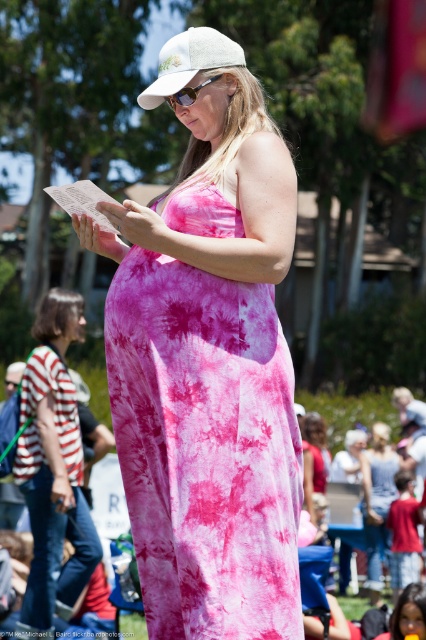
Question: Which object is positioned farthest from the white fabric baseball cap at upper center?

Choices:
 (A) tie-dye fabric dress at center
 (B) tie-dye fabric maxi dress at center

Answer: (B)

Question: Which of these objects is positioned closest to the white fabric baseball cap at upper center?

Choices:
 (A) tie-dye fabric dress at center
 (B) tie-dye fabric maxi dress at center

Answer: (A)

Question: Does tie-dye fabric dress at center have a lesser width compared to tie-dye fabric maxi dress at center?

Choices:
 (A) yes
 (B) no

Answer: (B)

Question: Which object appears farthest from the camera in this image?

Choices:
 (A) white fabric baseball cap at upper center
 (B) tie-dye fabric dress at center
 (C) tie-dye fabric maxi dress at center

Answer: (C)

Question: Does tie-dye fabric maxi dress at center have a greater width compared to white fabric baseball cap at upper center?

Choices:
 (A) no
 (B) yes

Answer: (A)

Question: Is tie-dye fabric dress at center below white fabric baseball cap at upper center?

Choices:
 (A) yes
 (B) no

Answer: (A)